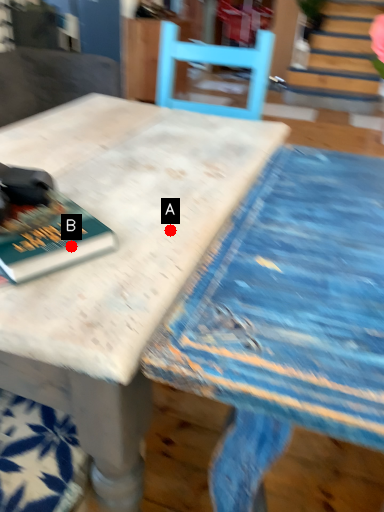
Question: Two points are circled on the image, labeled by A and B beside each circle. Among these points, which one is nearest to the camera?

Choices:
 (A) A is closer
 (B) B is closer

Answer: (B)